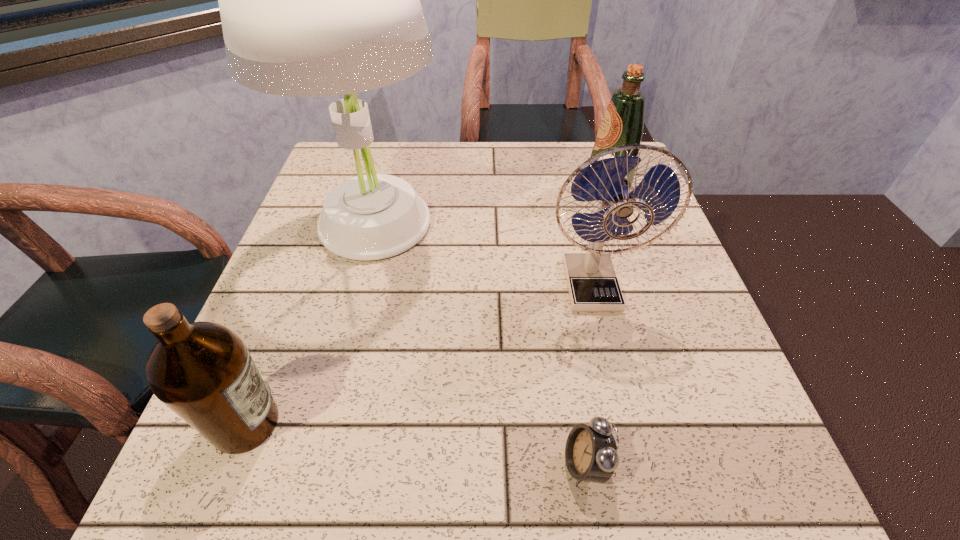
Identify which object is the fourth closest to the tallest object. Please provide its 2D coordinates. Your answer should be formatted as a tuple, i.e. [(x, y)], where the tuple contains the x and y coordinates of a point satisfying the conditions above.

[(591, 455)]

Find the location of `object that can be found as the second closest to the right olive oil`. object that can be found as the second closest to the right olive oil is located at coordinates (316, 0).

Locate an element on the screen. free spot that satisfies the following two spatial constraints: 1. on the front-facing side of the tallest object; 2. on the label of the nearer olive oil is located at coordinates (320, 423).

Find the location of a particular element. The image size is (960, 540). free spot that satisfies the following two spatial constraints: 1. on the front-facing side of the tallest object; 2. on the label of the left olive oil is located at coordinates (320, 423).

The image size is (960, 540). Identify the location of vacant space that satisfies the following two spatial constraints: 1. on the front-facing side of the lamp; 2. on the label of the nearer olive oil. (320, 423).

This screenshot has width=960, height=540. What are the coordinates of `vacant space that satisfies the following two spatial constraints: 1. on the front-facing side of the right olive oil; 2. on the front-facing side of the fan` in the screenshot? It's located at (642, 286).